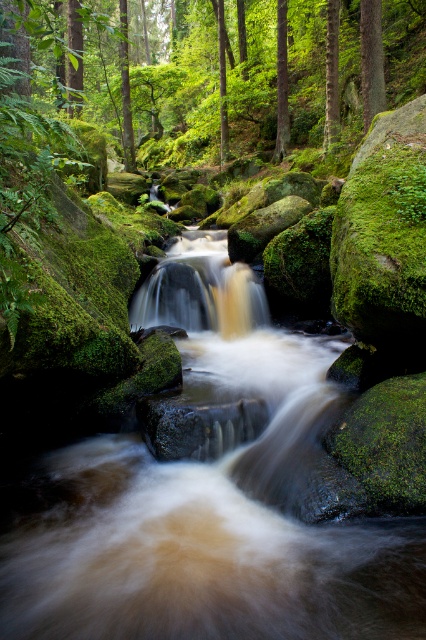
Find the location of a particular element. green mossy rocks at center is located at coordinates (178, 84).

Can you confirm if green mossy rocks at center is thinner than green rough bark tree at upper center?

No.

This screenshot has height=640, width=426. I want to click on green mossy rocks at center, so click(178, 84).

Locate an element on the screen. The height and width of the screenshot is (640, 426). green mossy rocks at center is located at coordinates (178, 84).

Is green mossy rocks at center to the left of green matte tree at upper center from the viewer's perspective?

Correct, you'll find green mossy rocks at center to the left of green matte tree at upper center.

Which of these two, green mossy rocks at center or green matte tree at upper center, stands shorter?

green matte tree at upper center is shorter.

Locate an element on the screen. green mossy rocks at center is located at coordinates (178, 84).

Where is `green mossy rocks at center`? The height and width of the screenshot is (640, 426). green mossy rocks at center is located at coordinates (178, 84).

Looking at this image, how far apart are brown smooth water at center and brown textured tree at center?

brown smooth water at center and brown textured tree at center are 38.29 feet apart.

Between point (305, 564) and point (333, 125), which one is positioned behind?

Point (333, 125)

Identify the location of brown smooth water at center. (204, 502).